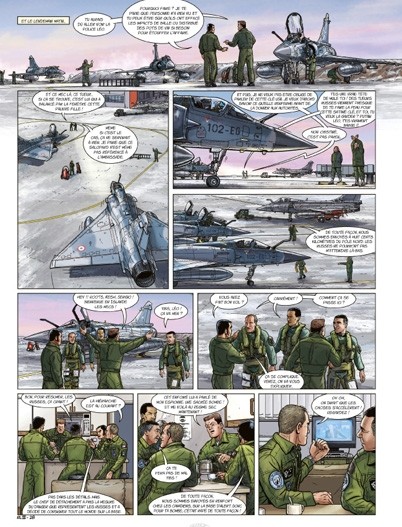
Where is `ladder in top picture`? The height and width of the screenshot is (527, 402). ladder in top picture is located at coordinates [115, 81].